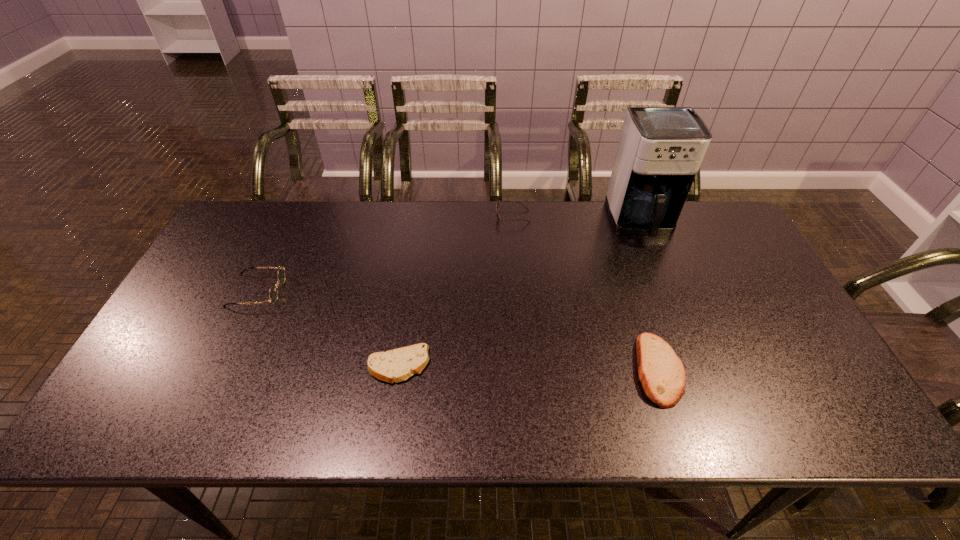
Where is `free region that satisfies the following two spatial constraints: 1. on the lenses of the right pita bread; 2. on the left side of the second tallest object`? Image resolution: width=960 pixels, height=540 pixels. free region that satisfies the following two spatial constraints: 1. on the lenses of the right pita bread; 2. on the left side of the second tallest object is located at coordinates (219, 369).

Where is `free spot that satisfies the following two spatial constraints: 1. on the lenses of the taller pita bread; 2. on the left side of the second tallest object`? The image size is (960, 540). free spot that satisfies the following two spatial constraints: 1. on the lenses of the taller pita bread; 2. on the left side of the second tallest object is located at coordinates (219, 369).